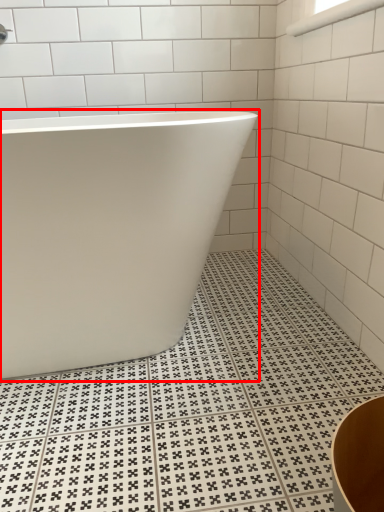
Question: From the image's perspective, considering the relative positions of bathtub (annotated by the red box) and window in the image provided, where is bathtub (annotated by the red box) located with respect to the staircase?

Choices:
 (A) above
 (B) below

Answer: (B)